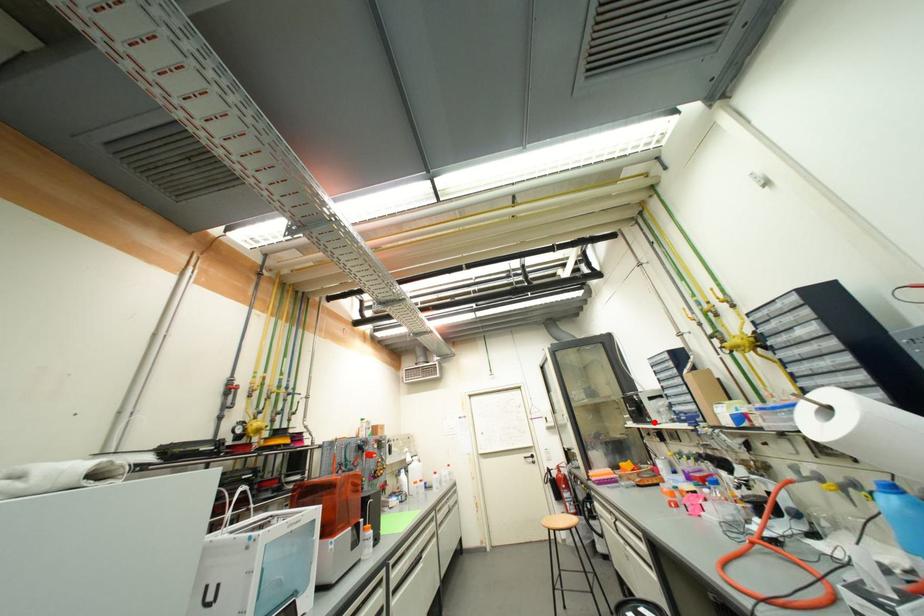
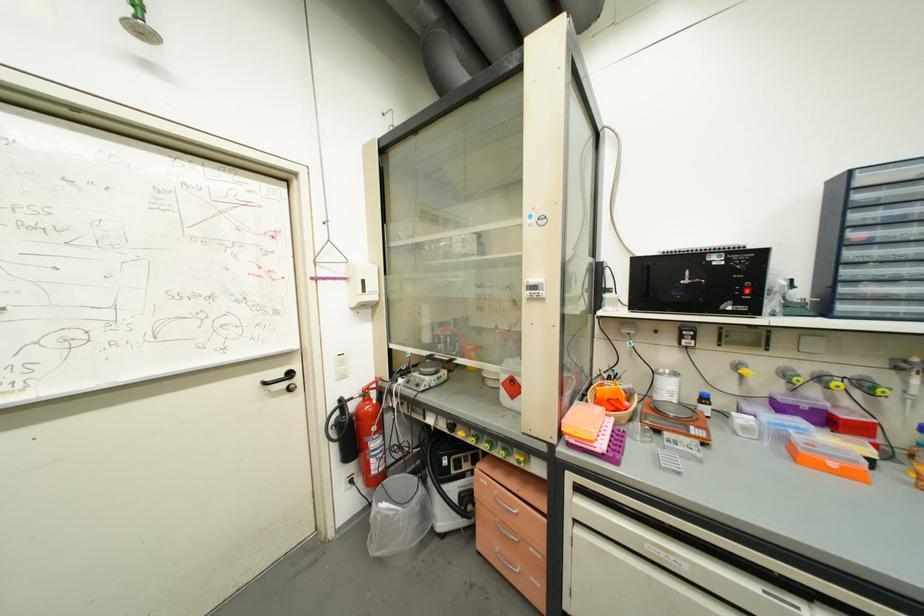
Find the pixel in the second image that matches the highlighted location in the first image.

(735, 310)